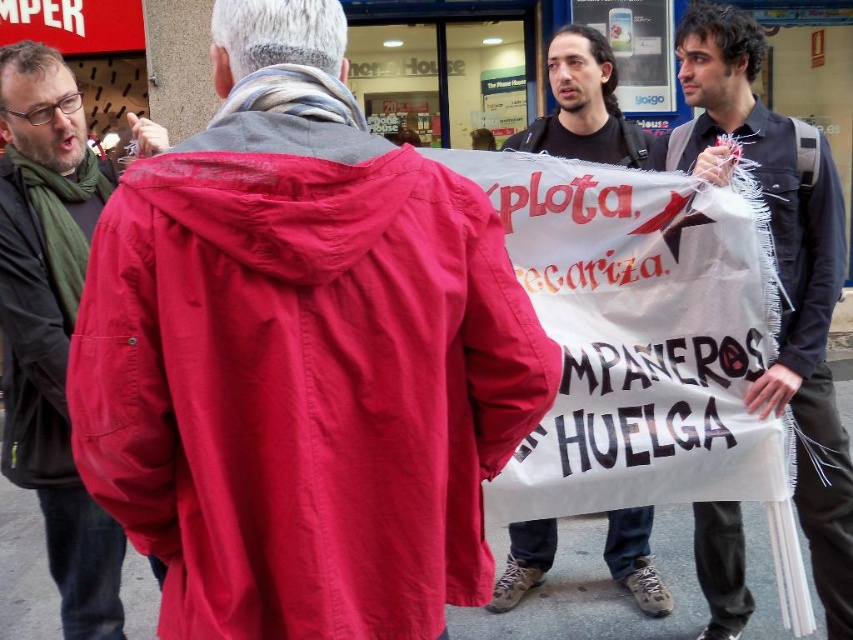
Who is more forward, (811, 547) or (4, 192)?

Point (4, 192) is in front.

Can you confirm if denim jacket at center is positioned to the left of matte black jacket at left?

No, denim jacket at center is not to the left of matte black jacket at left.

Is point (722, 32) farther from camera compared to point (39, 358)?

Yes, point (722, 32) is behind point (39, 358).

The image size is (853, 640). In order to click on denim jacket at center in this screenshot , I will do `click(780, 269)`.

Is point (62, 97) in front of point (541, 540)?

Yes, it is.

Which is below, matte red jacket at left or black cotton t-shirt at center?

Positioned lower is black cotton t-shirt at center.

Who is more forward, [96,161] or [624,131]?

Point [96,161] is more forward.

Where is `matte red jacket at left`? The width and height of the screenshot is (853, 640). matte red jacket at left is located at coordinates 51,323.

Can you confirm if matte red jacket at center is bigger than matte red jacket at left?

Incorrect, matte red jacket at center is not larger than matte red jacket at left.

Locate an element on the screen. matte red jacket at center is located at coordinates (302, 374).

Describe the element at coordinates (302, 374) in the screenshot. I see `matte red jacket at center` at that location.

The image size is (853, 640). Identify the location of matte red jacket at center. (302, 374).